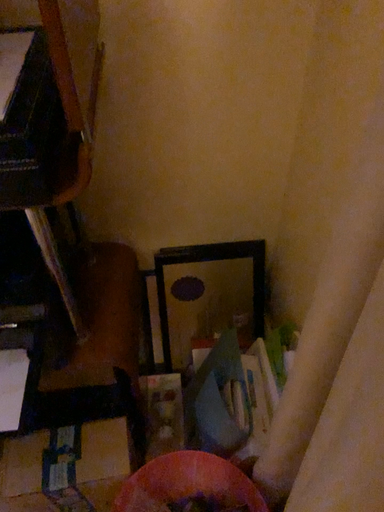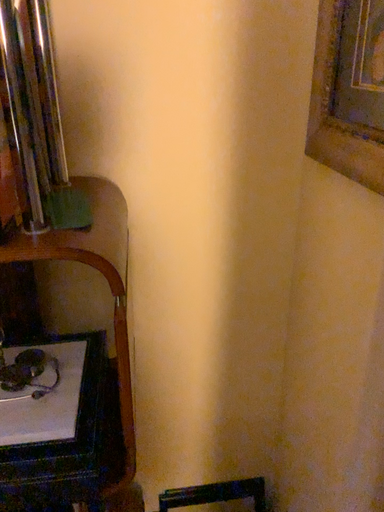
Question: Which way did the camera rotate in the video?

Choices:
 (A) rotated upward
 (B) rotated downward

Answer: (A)